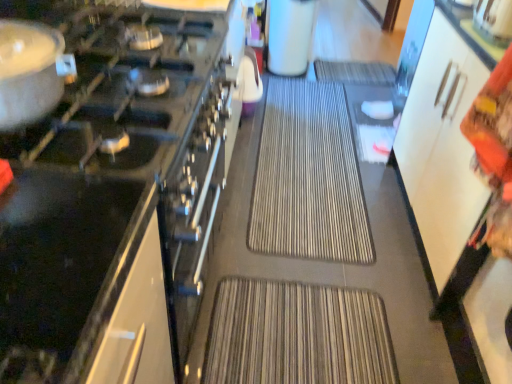
Question: Considering the relative positions of white matte coffee maker at upper center, the third appliance in the front-to-back sequence, and brown textured mat at center in the image provided, is white matte coffee maker at upper center, the third appliance in the front-to-back sequence, to the right of brown textured mat at center from the viewer's perspective?

Choices:
 (A) no
 (B) yes

Answer: (A)

Question: Is white matte coffee maker at upper center, which appears as the 2th appliance when viewed from the right, oriented away from brown textured mat at center?

Choices:
 (A) no
 (B) yes

Answer: (A)

Question: Is white matte coffee maker at upper center, the third appliance in the front-to-back sequence, further to camera compared to brown textured mat at center?

Choices:
 (A) no
 (B) yes

Answer: (B)

Question: From a real-world perspective, is white matte coffee maker at upper center, the third appliance ordered from the bottom, on brown textured mat at center?

Choices:
 (A) no
 (B) yes

Answer: (B)

Question: Is white matte coffee maker at upper center, acting as the first appliance starting from the back, thinner than brown textured mat at center?

Choices:
 (A) yes
 (B) no

Answer: (A)

Question: Does white matte coffee maker at upper center, which appears as the 2th appliance when viewed from the right, have a greater height compared to brown textured mat at center?

Choices:
 (A) no
 (B) yes

Answer: (B)

Question: Considering the relative sizes of matte silver pot at left and black glass cooktop at left, arranged as the first appliance when ordered from the bottom, in the image provided, is matte silver pot at left thinner than black glass cooktop at left, arranged as the first appliance when ordered from the bottom,?

Choices:
 (A) yes
 (B) no

Answer: (A)

Question: Is matte silver pot at left bigger than black glass cooktop at left, acting as the 3th appliance starting from the top?

Choices:
 (A) no
 (B) yes

Answer: (A)

Question: Is matte silver pot at left facing away from black glass cooktop at left, acting as the 3th appliance starting from the top?

Choices:
 (A) no
 (B) yes

Answer: (A)

Question: Can you confirm if matte silver pot at left is taller than black glass cooktop at left, arranged as the first appliance when ordered from the bottom?

Choices:
 (A) yes
 (B) no

Answer: (B)

Question: Is matte silver pot at left outside of black glass cooktop at left, arranged as the first appliance when ordered from the bottom?

Choices:
 (A) yes
 (B) no

Answer: (A)

Question: Is matte silver pot at left wider than black glass cooktop at left, the 3th appliance in the back-to-front sequence?

Choices:
 (A) yes
 (B) no

Answer: (B)

Question: Is metallic silver kettle at upper right, which appears as the 2th appliance when viewed from the top, further to the viewer compared to white matte coffee maker at upper center, the third appliance in the front-to-back sequence?

Choices:
 (A) no
 (B) yes

Answer: (A)